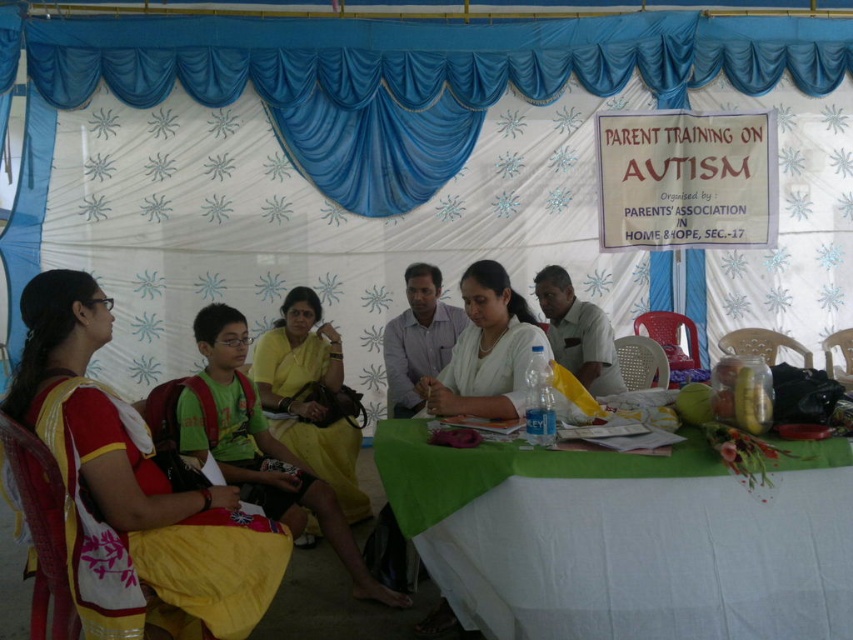
Based on the photo, you are a photographer at the event and need to ensure both the green fabric shirt at center and the white glossy shirt at center are visible in the photo. Given their sizes, which shirt should you focus on to ensure both are in frame?

The green fabric shirt at center is larger than the white glossy shirt at center, so focusing on the green fabric shirt at center would ensure both are visible as it occupies more space in the frame.

You are a photographer positioned at the back of the tent. You want to take a photo of the green cloth table at center and the yellow fabric dress at center. Which object should you focus on first to ensure both are in the frame?

The green cloth table at center is in front of the yellow fabric dress at center, so you should focus on the green cloth table at center first to ensure both are in the frame.

You are at the parent training session and notice two people sitting at the table. One is wearing a green fabric shirt at center and the other a white glossy shirt at center. Which shirt is positioned to the left?

The green fabric shirt at center is to the left of the white glossy shirt at center.